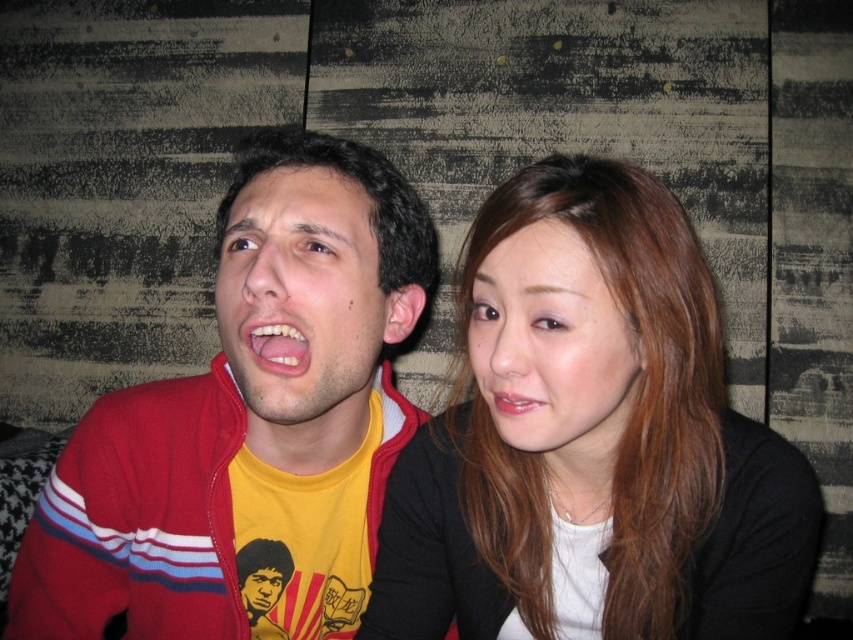
Is smooth brown hair at center thinner than matte red jacket at left?

Yes, smooth brown hair at center is thinner than matte red jacket at left.

Which is below, smooth brown hair at center or matte red jacket at left?

Positioned lower is matte red jacket at left.

Where is `smooth brown hair at center`? smooth brown hair at center is located at coordinates (595, 436).

Between point (320, 284) and point (517, 394), which one is positioned behind?

The point (320, 284) is more distant.

Between matte red jacket at left and matte pink lips at center, which one appears on the left side from the viewer's perspective?

matte red jacket at left

The image size is (853, 640). What do you see at coordinates (248, 422) in the screenshot?
I see `matte red jacket at left` at bounding box center [248, 422].

What are the coordinates of `matte red jacket at left` in the screenshot? It's located at (248, 422).

Identify the location of smooth brown hair at center. This screenshot has width=853, height=640. (595, 436).

Who is taller, smooth brown hair at center or white glossy teeth at center?

With more height is smooth brown hair at center.

Consider the image. Who is more distant from viewer, (704, 621) or (283, 356)?

Point (704, 621)

The image size is (853, 640). Identify the location of smooth brown hair at center. pos(595,436).